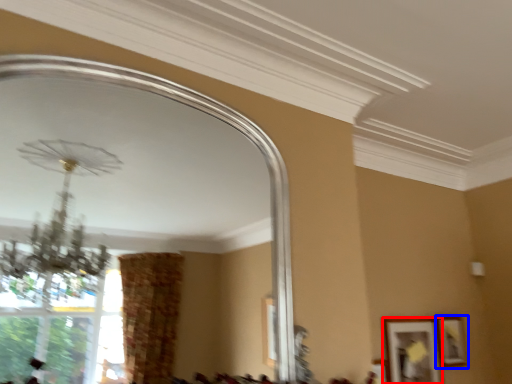
Question: Which object is closer to the camera taking this photo, picture frame (highlighted by a red box) or picture frame (highlighted by a blue box)?

Choices:
 (A) picture frame
 (B) picture frame

Answer: (A)